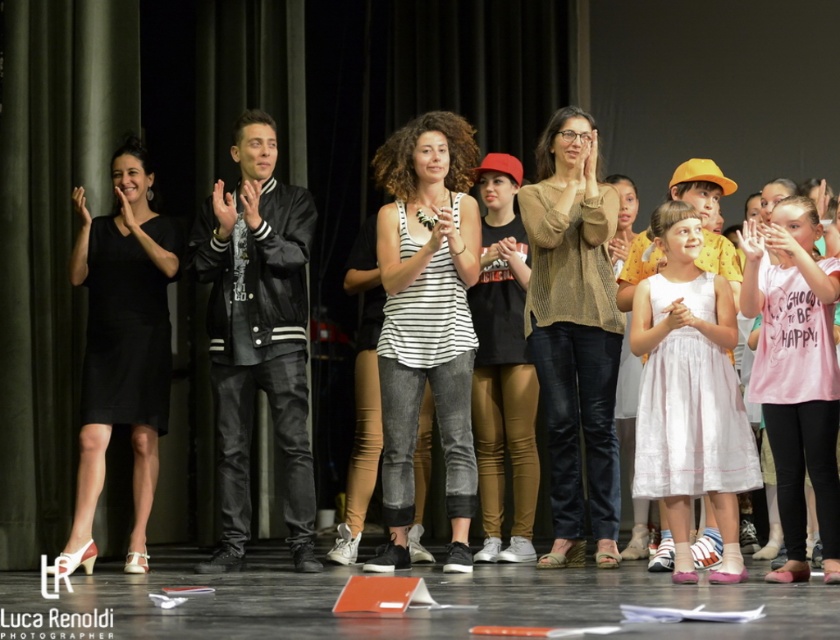
You are standing in the audience of the theater and see the point marked at coordinates (122,346). Which object in the scene is this point located on?

The point at coordinates (122,346) is located on the black satin dress at center.

From the picture: You are standing at the back of the stage and want to take a photo of the two points mentioned. Which point, point (471,140) or point (487,520), will appear larger in your camera view?

Point (471,140) will appear larger in the camera view because it is closer to the camera than point (487,520).

You are standing on the stage and want to move from your current position to the exit located at point (x=95, y=224). There is an obstacle at point (x=562, y=387). Can you safely walk around the obstacle to reach the exit?

Point (x=562, y=387) is in front of point (x=95, y=224), so the obstacle is blocking the direct path to the exit. You will need to navigate around it by moving to either side of the obstacle to reach the exit safely.